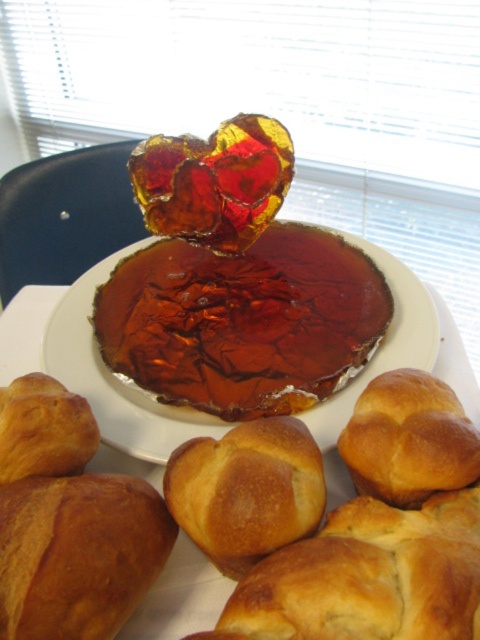
Question: From the image, what is the correct spatial relationship of shiny brown cake at center in relation to golden brown doughnut at lower right?

Choices:
 (A) right
 (B) left

Answer: (B)

Question: Among these points, which one is farthest from the camera?

Choices:
 (A) (311, 289)
 (B) (90, 444)
 (C) (233, 429)
 (D) (14, 520)

Answer: (A)

Question: Among these points, which one is nearest to the camera?

Choices:
 (A) (225, 536)
 (B) (369, 433)
 (C) (84, 410)
 (D) (136, 576)

Answer: (A)

Question: Which point is closer to the camera?

Choices:
 (A) golden brown doughnut at lower right
 (B) shiny brown cake at center
 (C) golden brown bread at center
 (D) golden brown croissant at lower left

Answer: (C)

Question: Is golden brown bread at center positioned before golden brown doughnut at lower right?

Choices:
 (A) yes
 (B) no

Answer: (A)

Question: Observing the image, what is the correct spatial positioning of shiny brown cake at center in reference to golden brown doughnut at lower right?

Choices:
 (A) above
 (B) below

Answer: (A)